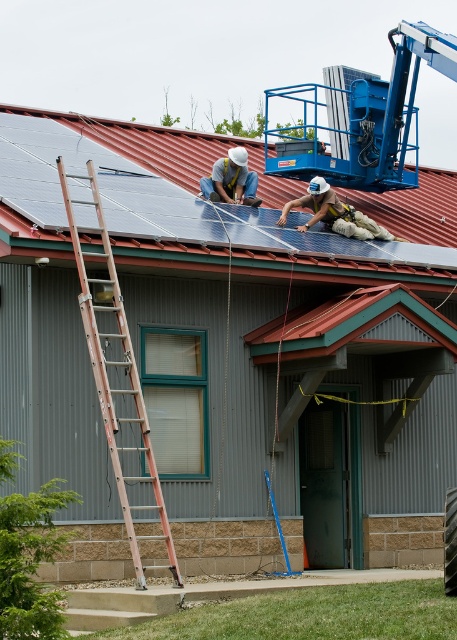
Who is lower down, metallic solar panels at upper center or white hard hat at upper center?

white hard hat at upper center

You are a GUI agent. You are given a task and a screenshot of the screen. Output one action in this format:
    pyautogui.click(x=<x>, y=<y>)
    Task: Click on the metallic solar panels at upper center
    
    Given the screenshot: What is the action you would take?
    pyautogui.click(x=110, y=173)

The width and height of the screenshot is (457, 640). In order to click on metallic solar panels at upper center in this screenshot , I will do `click(110, 173)`.

Which is below, orange metallic ladder at left or matte white helmet at upper center?

orange metallic ladder at left is below.

Identify the location of orange metallic ladder at left. (116, 376).

Image resolution: width=457 pixels, height=640 pixels. I want to click on orange metallic ladder at left, so click(x=116, y=376).

Can you confirm if white hard hat at upper center is positioned to the left of matte white helmet at upper center?

In fact, white hard hat at upper center is to the right of matte white helmet at upper center.

Between point (327, 198) and point (210, 179), which one is positioned behind?

The point (210, 179) is more distant.

This screenshot has height=640, width=457. In order to click on white hard hat at upper center in this screenshot , I will do `click(334, 212)`.